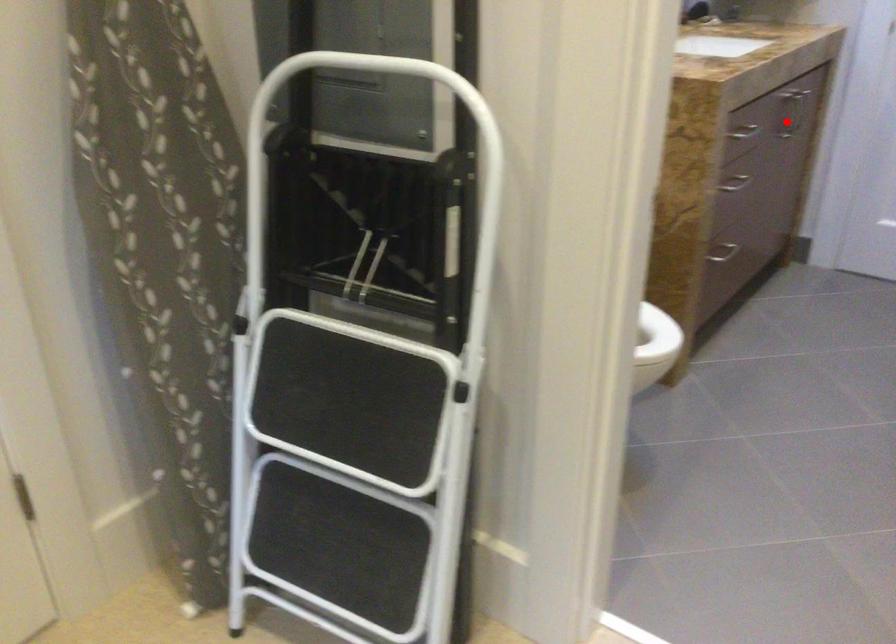
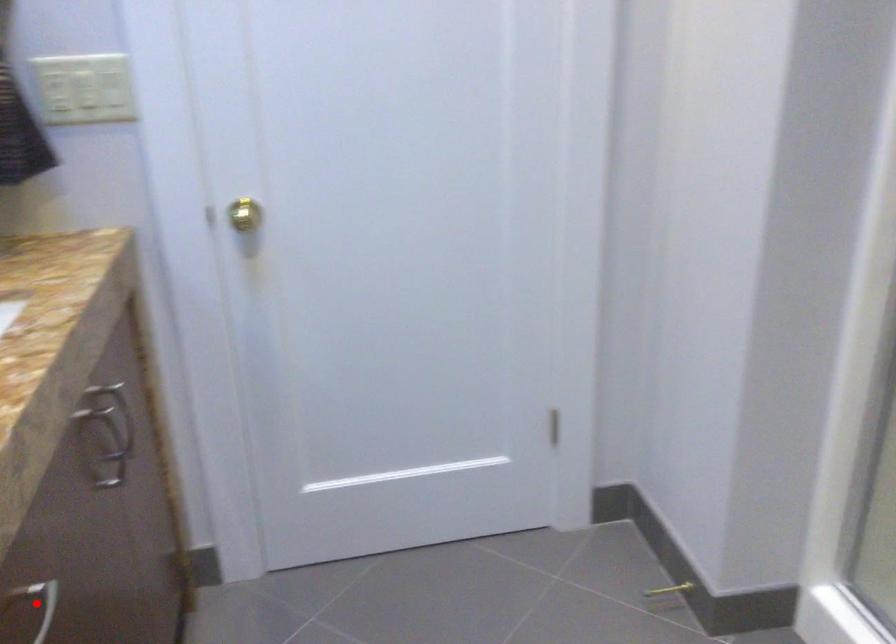
I am providing you with two images of the same scene from different viewpoints. A red point is marked on the first image and another point is marked on the second image. Do the highlighted points in image1 and image2 indicate the same real-world spot?

No